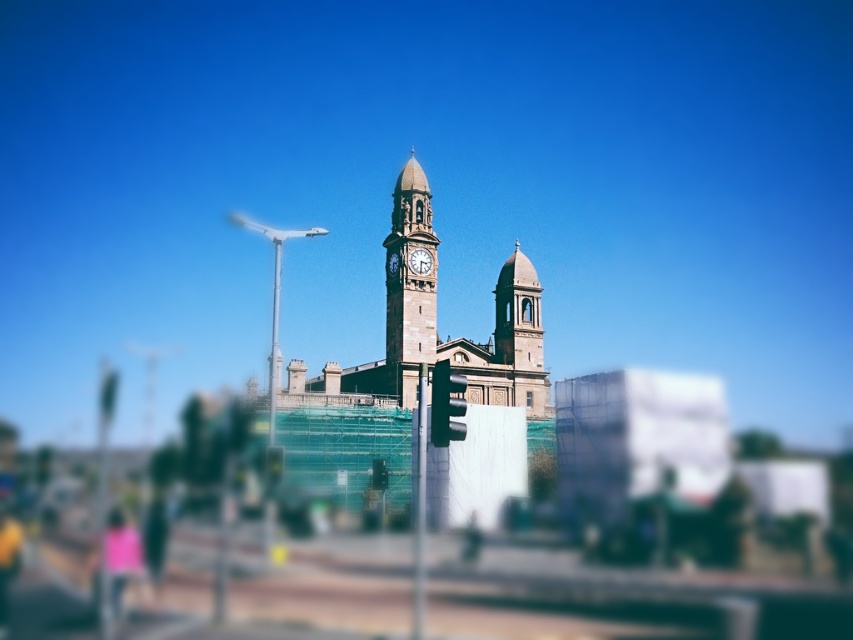
Is point (503, 310) farther from viewer compared to point (111, 600)?

Yes.

Can you confirm if smooth stone tower at center is thinner than pink fabric at lower left?

Yes, smooth stone tower at center is thinner than pink fabric at lower left.

Is point (503, 355) positioned before point (115, 604)?

That is False.

This screenshot has width=853, height=640. Find the location of `smooth stone tower at center`. smooth stone tower at center is located at coordinates (520, 333).

Is stone clock tower at center smaller than white stone clock at center?

No, stone clock tower at center is not smaller than white stone clock at center.

Who is taller, stone clock tower at center or white stone clock at center?

With more height is stone clock tower at center.

Image resolution: width=853 pixels, height=640 pixels. Find the location of `stone clock tower at center`. stone clock tower at center is located at coordinates (410, 269).

Who is more forward, (502, 403) or (386, 268)?

Point (386, 268) is in front.

The height and width of the screenshot is (640, 853). Find the location of `smooth stone tower at center`. smooth stone tower at center is located at coordinates (520, 333).

This screenshot has width=853, height=640. Describe the element at coordinates (520, 333) in the screenshot. I see `smooth stone tower at center` at that location.

Where is `smooth stone tower at center`? This screenshot has width=853, height=640. smooth stone tower at center is located at coordinates (520, 333).